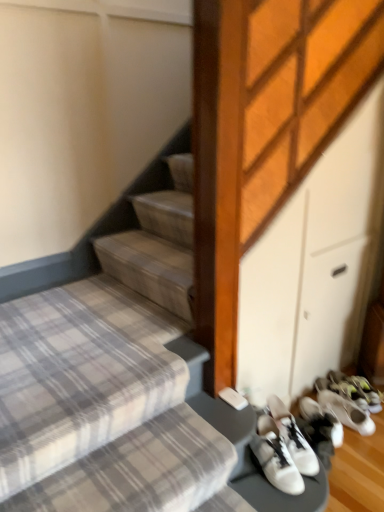
Question: Is white leather sneakers at lower right, the second footwear viewed from the back, in front of white matte sneakers at lower right, positioned as the first footwear in right-to-left order?

Choices:
 (A) no
 (B) yes

Answer: (B)

Question: Is white leather sneakers at lower right, the second footwear viewed from the back, far from white matte sneakers at lower right, arranged as the second footwear when viewed from the front?

Choices:
 (A) no
 (B) yes

Answer: (A)

Question: Is white leather sneakers at lower right, arranged as the first footwear when viewed from the left, at the left side of white matte sneakers at lower right, arranged as the second footwear when viewed from the front?

Choices:
 (A) yes
 (B) no

Answer: (A)

Question: From the image's perspective, is white leather sneakers at lower right, arranged as the first footwear when viewed from the left, under white matte sneakers at lower right, positioned as the first footwear in right-to-left order?

Choices:
 (A) yes
 (B) no

Answer: (A)

Question: Does white leather sneakers at lower right, arranged as the first footwear when viewed from the left, come behind white matte sneakers at lower right, arranged as the second footwear when viewed from the front?

Choices:
 (A) yes
 (B) no

Answer: (B)

Question: Is point (347, 438) positioned closer to the camera than point (337, 415)?

Choices:
 (A) farther
 (B) closer

Answer: (B)

Question: From a real-world perspective, is white leather sneakers at lower right, arranged as the first footwear when viewed from the left, above or below white matte sneakers at lower right, which is the second footwear from left to right?

Choices:
 (A) above
 (B) below

Answer: (A)

Question: From the image's perspective, is white leather sneakers at lower right, the second footwear viewed from the back, located above or below white matte sneakers at lower right, which is counted as the 1th footwear, starting from the back?

Choices:
 (A) below
 (B) above

Answer: (A)

Question: Is white leather sneakers at lower right, positioned as the 2th footwear in right-to-left order, situated inside white matte sneakers at lower right, which is counted as the 1th footwear, starting from the back, or outside?

Choices:
 (A) inside
 (B) outside

Answer: (B)

Question: From a real-world perspective, is white leather sneakers at lower right, the second footwear viewed from the back, positioned above or below plaid fabric stairs at lower left?

Choices:
 (A) above
 (B) below

Answer: (B)

Question: Choose the correct answer: Is white leather sneakers at lower right, which is the 1th footwear from front to back, inside plaid fabric stairs at lower left or outside it?

Choices:
 (A) inside
 (B) outside

Answer: (B)

Question: Is white leather sneakers at lower right, the second footwear viewed from the back, taller or shorter than plaid fabric stairs at lower left?

Choices:
 (A) tall
 (B) short

Answer: (B)

Question: Visually, is white leather sneakers at lower right, positioned as the 2th footwear in right-to-left order, positioned to the left or to the right of plaid fabric stairs at lower left?

Choices:
 (A) left
 (B) right

Answer: (B)

Question: From a real-world perspective, is white matte sneakers at lower right, which is the second footwear from left to right, above or below plaid fabric stairs at lower left?

Choices:
 (A) above
 (B) below

Answer: (B)

Question: Is white matte sneakers at lower right, positioned as the first footwear in right-to-left order, inside or outside of plaid fabric stairs at lower left?

Choices:
 (A) outside
 (B) inside

Answer: (A)